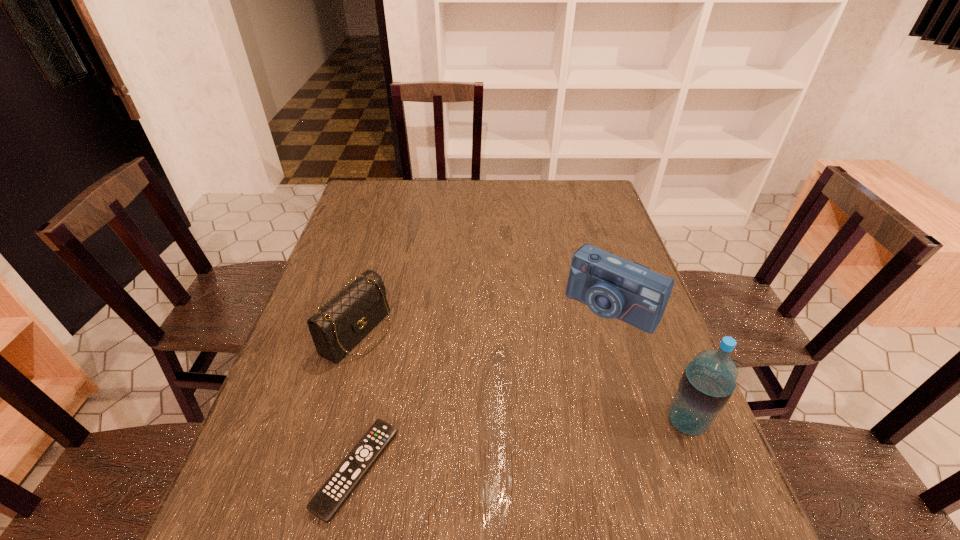
The image size is (960, 540). Identify the location of blank region between the clutch bag and the water bottle. (522, 377).

Identify the location of free area in between the camera and the remote control. (484, 388).

Where is `unoccupied area between the clutch bag and the shortest object`? Image resolution: width=960 pixels, height=540 pixels. unoccupied area between the clutch bag and the shortest object is located at coordinates 357,401.

Where is `object that is the closest to the clutch bag`? object that is the closest to the clutch bag is located at coordinates (327, 501).

Select which object is the second closest to the camera. Please provide its 2D coordinates. Your answer should be formatted as a tuple, i.e. [(x, y)], where the tuple contains the x and y coordinates of a point satisfying the conditions above.

[(341, 323)]

At what (x,y) coordinates should I click in order to perform the action: click on vacant region that satisfies the following two spatial constraints: 1. on the front side of the clutch bag; 2. on the right side of the water bottle. Please return your answer as a coordinate pair (x, y). Image resolution: width=960 pixels, height=540 pixels. Looking at the image, I should click on pyautogui.click(x=332, y=422).

Where is `vacant space that satisfies the following two spatial constraints: 1. on the front side of the water bottle; 2. on the left side of the camera`? vacant space that satisfies the following two spatial constraints: 1. on the front side of the water bottle; 2. on the left side of the camera is located at coordinates (648, 422).